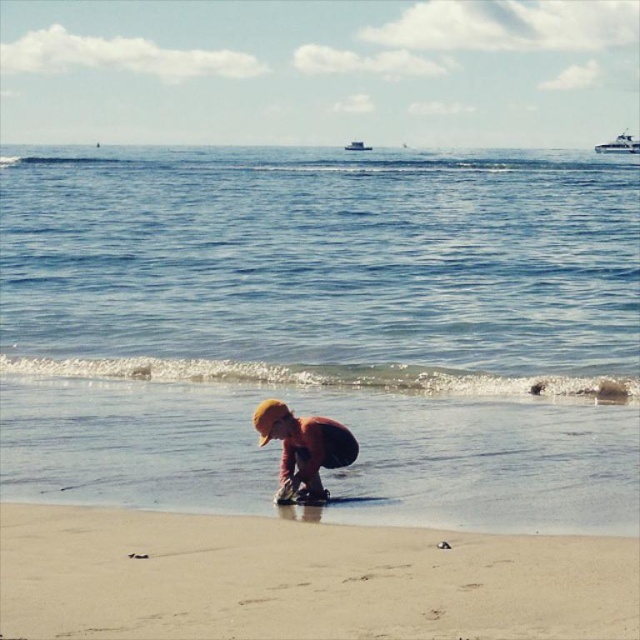
Who is lower down, blue water at center or white glossy boat at upper right?

Positioned lower is blue water at center.

Can you confirm if blue water at center is thinner than white glossy boat at upper right?

No, blue water at center is not thinner than white glossy boat at upper right.

Describe the element at coordinates (321, 266) in the screenshot. I see `blue water at center` at that location.

The width and height of the screenshot is (640, 640). I want to click on blue water at center, so click(x=321, y=266).

Is point (320, 433) positioned after point (362, 148)?

That is False.

Find the location of a particular element. The height and width of the screenshot is (640, 640). orange fabric boy at center is located at coordinates (304, 449).

At what (x,y) coordinates should I click in order to perform the action: click on orange fabric boy at center. Please return your answer as a coordinate pair (x, y). This screenshot has width=640, height=640. Looking at the image, I should click on (304, 449).

Can you confirm if white glossy boat at upper right is positioned below white plastic boat at upper center?

Yes, white glossy boat at upper right is below white plastic boat at upper center.

Between point (621, 145) and point (360, 140), which one is positioned in front?

Positioned in front is point (621, 145).

Does point (632, 140) come in front of point (358, 141)?

That is True.

Find the location of a particular element. This screenshot has height=640, width=640. white glossy boat at upper right is located at coordinates (618, 145).